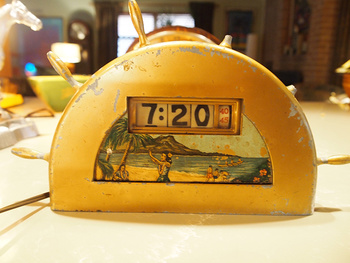
Where is `green ceramic bowl`? The width and height of the screenshot is (350, 263). green ceramic bowl is located at coordinates (49, 89).